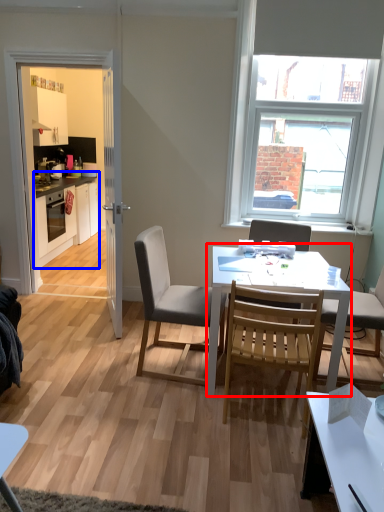
Question: Which of the following is the farthest to the observer, round table (highlighted by a red box) or cabinetry (highlighted by a blue box)?

Choices:
 (A) round table
 (B) cabinetry

Answer: (B)